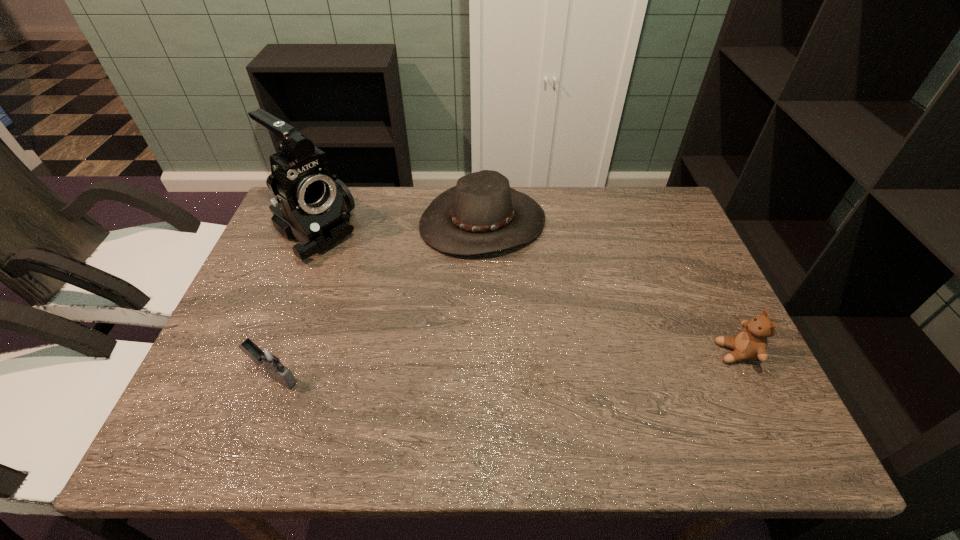
At what (x,y) coordinates should I click in order to perform the action: click on object identified as the second closest to the rightmost object. Please return your answer as a coordinate pair (x, y). Looking at the image, I should click on (312, 206).

Image resolution: width=960 pixels, height=540 pixels. Find the location of `object that is the third closest to the igniter`. object that is the third closest to the igniter is located at coordinates (751, 343).

I want to click on free space in the image that satisfies the following two spatial constraints: 1. on the back side of the rightmost object; 2. on the front-facing side of the igniter, so click(x=282, y=353).

Identify the location of vacant space that satisfies the following two spatial constraints: 1. on the front side of the camcorder; 2. on the front-facing side of the teddy bear. (267, 353).

At what (x,y) coordinates should I click in order to perform the action: click on vacant point that satisfies the following two spatial constraints: 1. on the front side of the rightmost object; 2. on the front-facing side of the hat. Please return your answer as a coordinate pair (x, y). This screenshot has width=960, height=540. Looking at the image, I should click on pyautogui.click(x=484, y=353).